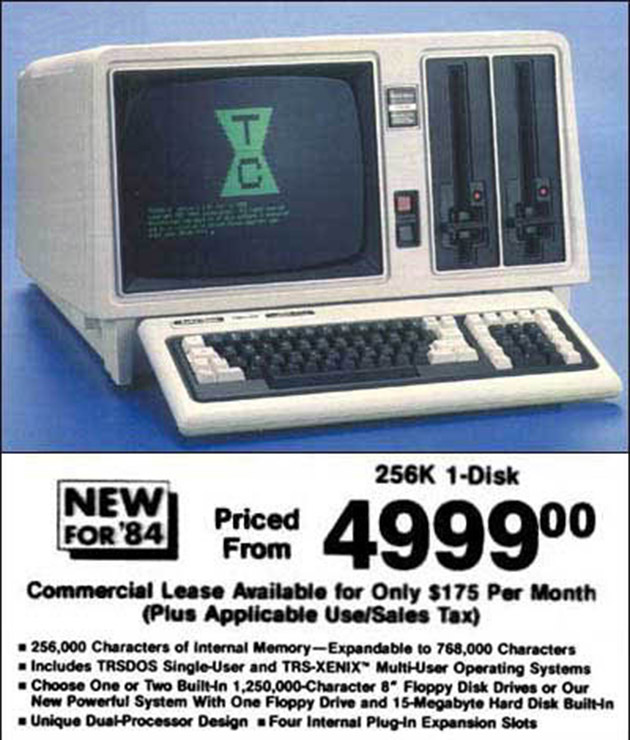
The height and width of the screenshot is (740, 630). In order to click on monitor in this screenshot , I will do `click(50, 212)`.